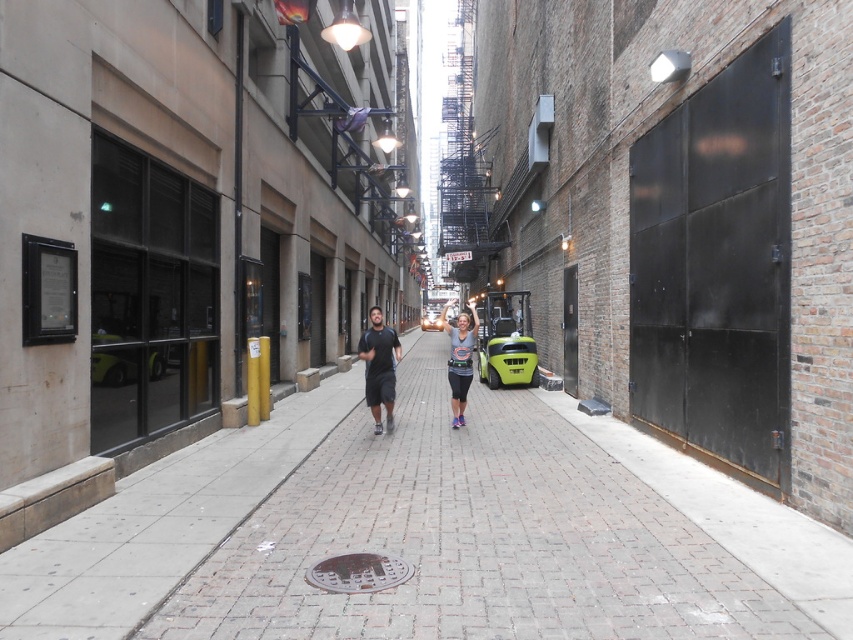
Consider the image. You are a delivery person who needs to quickly pass through the alleyway. You see the dark gray fabric shirt at center and the green matte forklift at center. Which object is bigger and might block your path?

The dark gray fabric shirt at center is larger in size than the green matte forklift at center, so it might block your path more than the forklift.